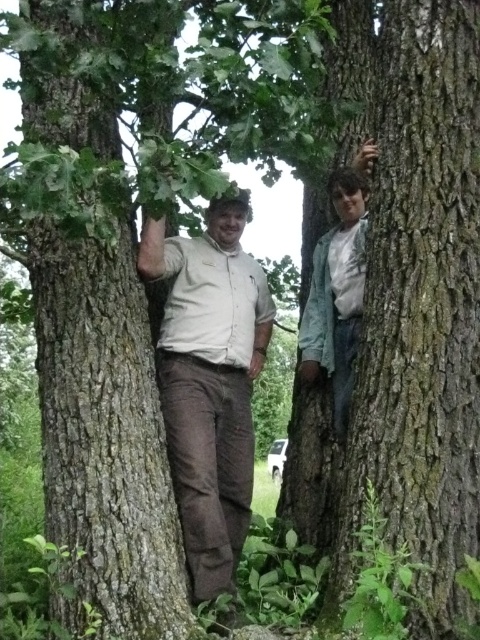
Question: Estimate the real-world distances between objects in this image. Which object is closer to the smooth brown bark at left?

Choices:
 (A) green cotton shirt at right
 (B) matte khaki shirt at center

Answer: (B)

Question: Which of the following is the farthest from the observer?

Choices:
 (A) (348, 284)
 (B) (170, 237)
 (C) (83, 544)

Answer: (B)

Question: Is matte khaki shirt at center below green cotton shirt at right?

Choices:
 (A) no
 (B) yes

Answer: (B)

Question: Does matte khaki shirt at center appear over green cotton shirt at right?

Choices:
 (A) no
 (B) yes

Answer: (A)

Question: Estimate the real-world distances between objects in this image. Which object is farther from the green cotton shirt at right?

Choices:
 (A) matte khaki shirt at center
 (B) smooth brown bark at left

Answer: (B)

Question: Is smooth brown bark at left thinner than matte khaki shirt at center?

Choices:
 (A) yes
 (B) no

Answer: (B)